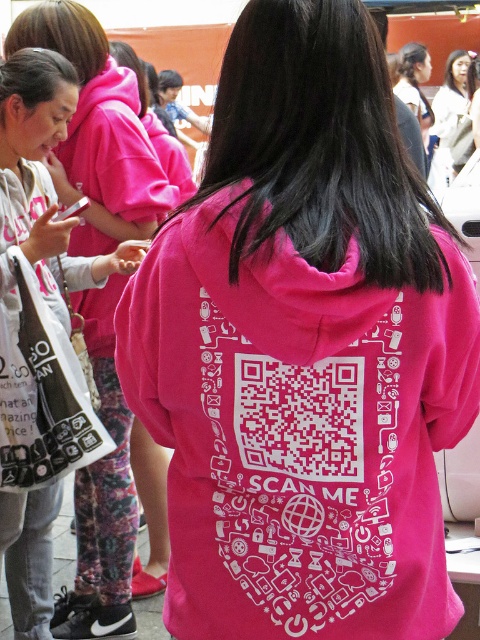
You are a photographer at the event and need to capture a clear photo of both the pink matte hoodie at upper center and the white cotton blouse at upper center. Which clothing item is shorter and might need to be positioned higher in the frame to ensure both are fully visible?

The pink matte hoodie at upper center is shorter than the white cotton blouse at upper center. To ensure both are fully visible, position the pink matte hoodie at upper center higher in the frame so it doesn not get cut off by the bottom of the image.

You are a photographer at the event and need to capture a photo that includes both the pink matte hoodie at upper center and the white cotton blouse at upper center. Given their positions, what is the minimum distance you should set your camera lens to ensure both are in frame?

The minimum distance your camera lens should be set is 7.17 meters to ensure both the pink matte hoodie at upper center and the white cotton blouse at upper center are in frame.

You are at an event and see the pink matte hoodie at upper center and the white cotton blouse at upper center. Which one is positioned more to the left side of the scene?

The pink matte hoodie at upper center is positioned more to the left side of the scene compared to the white cotton blouse at upper center.